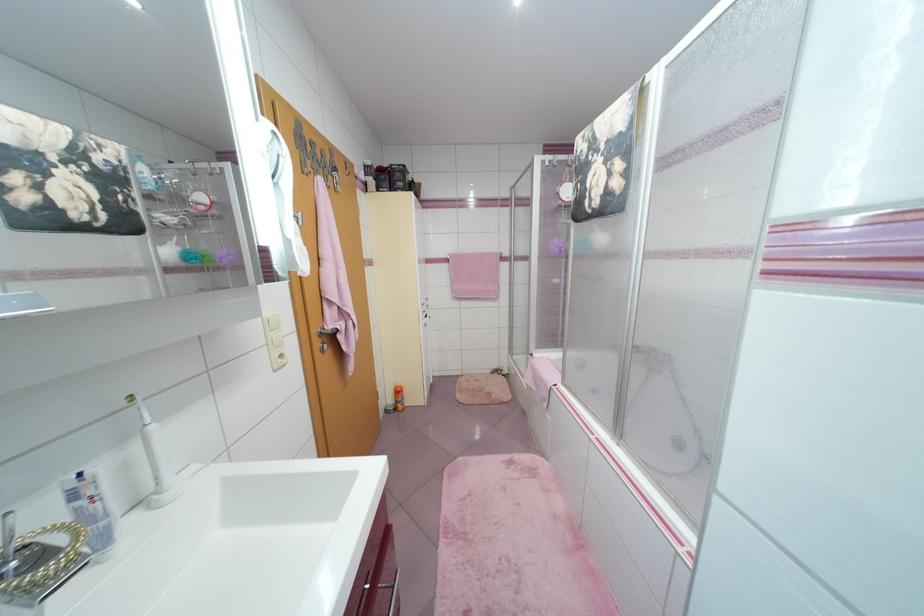
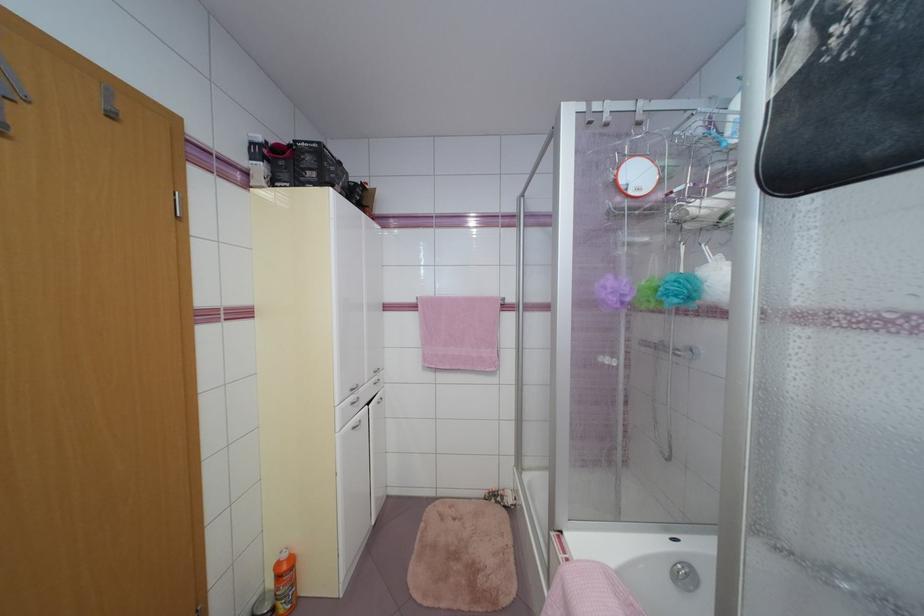
Find the pixel in the second image that matches point 383,190 in the first image.

(276, 185)